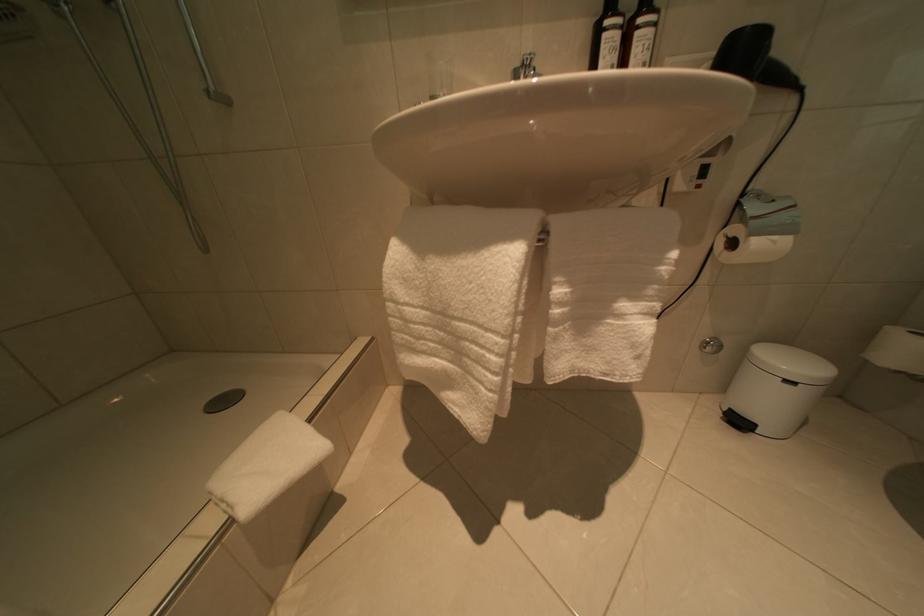
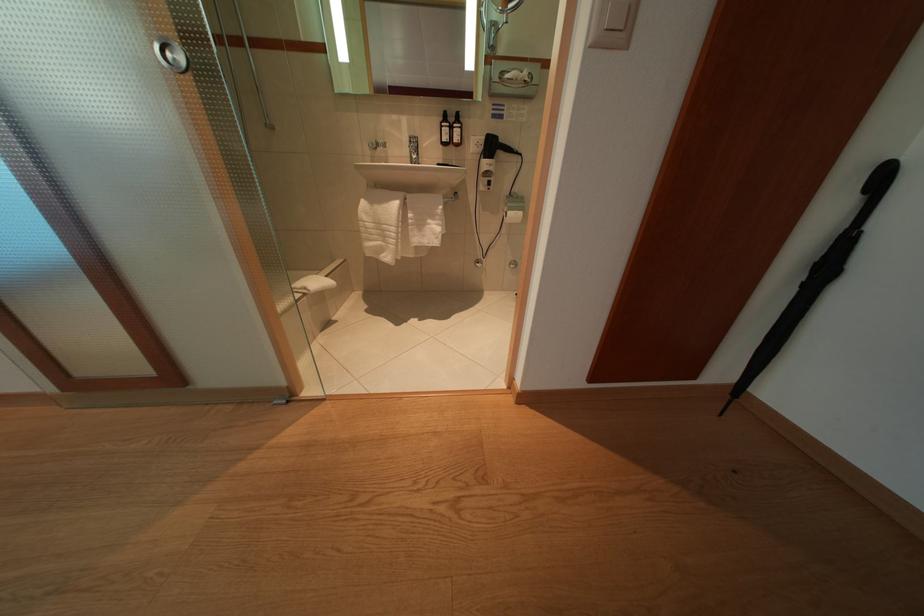
Locate, in the second image, the point that corresponds to the point at 764,248 in the first image.

(517, 219)